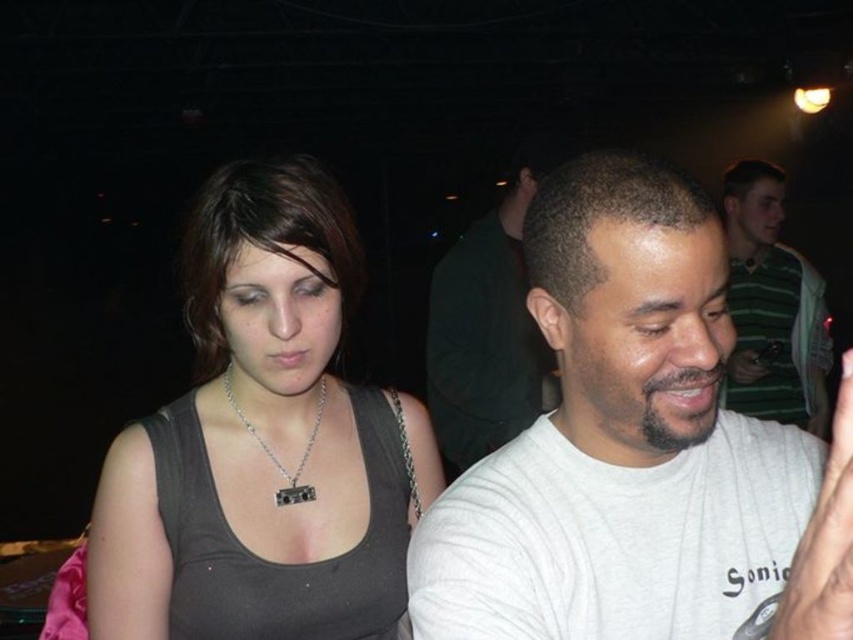
Question: Observing the image, what is the correct spatial positioning of gray cotton shirt at center in reference to green striped shirt at upper right?

Choices:
 (A) above
 (B) below

Answer: (A)

Question: Which object is positioned farthest from the matte black tank top at center?

Choices:
 (A) gray cotton shirt at center
 (B) green striped shirt at upper right
 (C) white matte hand at lower right
 (D) white cotton t-shirt at center

Answer: (B)

Question: Among these objects, which one is nearest to the camera?

Choices:
 (A) green striped shirt at upper right
 (B) matte black tank top at center
 (C) white matte hand at lower right
 (D) white cotton t-shirt at center

Answer: (D)

Question: Considering the relative positions of white cotton t-shirt at center and white matte hand at lower right in the image provided, where is white cotton t-shirt at center located with respect to white matte hand at lower right?

Choices:
 (A) above
 (B) below

Answer: (A)

Question: Based on their relative distances, which object is nearer to the green striped shirt at upper right?

Choices:
 (A) white matte hand at lower right
 (B) matte black tank top at center
 (C) gray cotton shirt at center
 (D) white cotton t-shirt at center

Answer: (C)

Question: Is matte black tank top at center wider than gray cotton shirt at center?

Choices:
 (A) no
 (B) yes

Answer: (A)